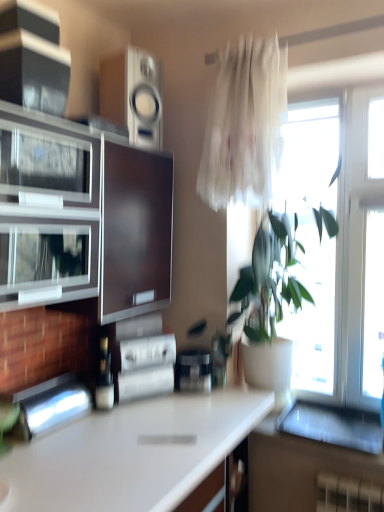
I want to click on vacant point above satin black coffee maker at center, arranged as the fourth appliance when viewed from the top (from a real-world perspective), so click(200, 349).